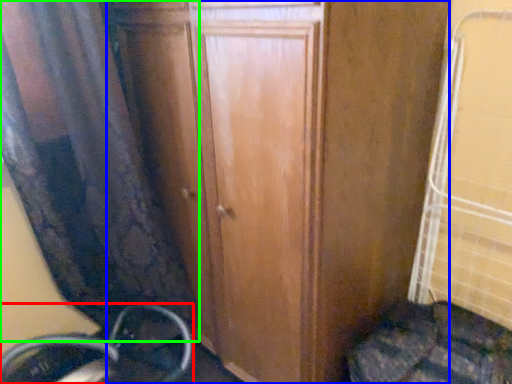
Question: Considering the real-world distances, which object is closest to wheel (highlighted by a red box)? door (highlighted by a blue box) or curtain (highlighted by a green box).

Choices:
 (A) door
 (B) curtain

Answer: (B)